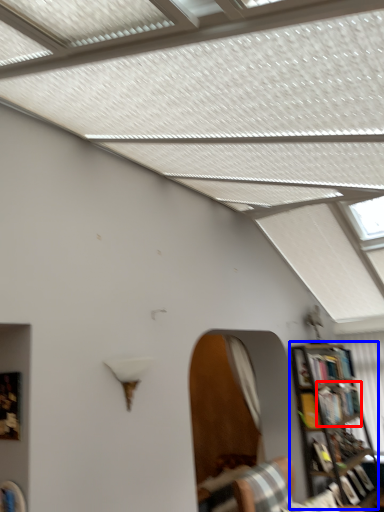
Question: Among these objects, which one is nearest to the camera, book (highlighted by a red box) or bookcase (highlighted by a blue box)?

Choices:
 (A) book
 (B) bookcase

Answer: (B)